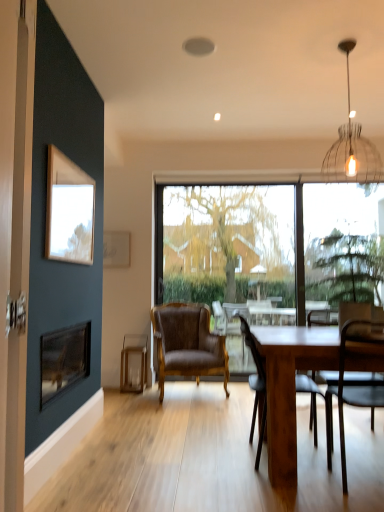
Question: Considering the positions of clear glass candlestick at lower center and wooden picture frame at upper left, which appears as the second picture frame when viewed from the back, in the image, is clear glass candlestick at lower center taller or shorter than wooden picture frame at upper left, which appears as the second picture frame when viewed from the back,?

Choices:
 (A) tall
 (B) short

Answer: (B)

Question: In the image, is clear glass candlestick at lower center positioned in front of or behind wooden picture frame at upper left, the first picture frame positioned from the front?

Choices:
 (A) front
 (B) behind

Answer: (B)

Question: Which object is positioned farthest from the wooden picture frame at upper left, the first picture frame positioned from the front?

Choices:
 (A) transparent glass window at center
 (B) clear glass candlestick at lower center
 (C) black glass fireplace at left
 (D) white paper at upper left, positioned as the first picture frame in back-to-front order
 (E) green leafy tree at center, arranged as the first tree when viewed from the back

Answer: (E)

Question: Estimate the real-world distances between objects in this image. Which object is farther from the wooden table at center?

Choices:
 (A) green leafy tree at center, the second tree viewed from the front
 (B) black glass fireplace at left
 (C) white paper at upper left, which is the 2th picture frame in front-to-back order
 (D) metallic dark brown chair at right, which is the third chair in left-to-right order
 (E) clear glass candlestick at lower center

Answer: (A)